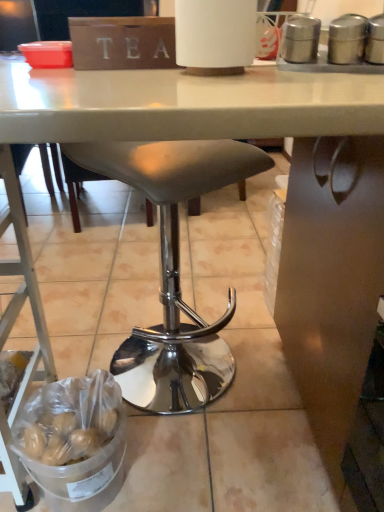
At what (x,y) coordinates should I click in order to perform the action: click on free point to the right of matte gray stool at center. Please return your answer as a coordinate pair (x, y). The image size is (384, 512). Looking at the image, I should click on (264, 364).